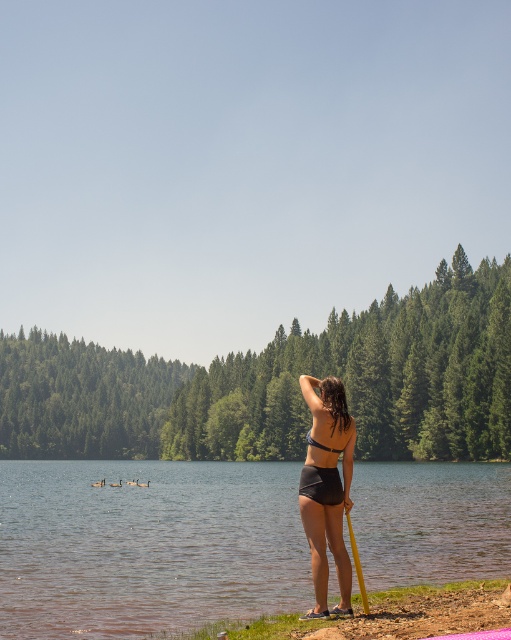
You are a photographer wanting to capture the clear water at shore right and the matte black bikini at center in the same frame. Which object should you focus on first to ensure both are in the frame?

Since the clear water at shore right is wider than the matte black bikini at center, you should focus on the clear water at shore right first to ensure both fit within the frame.